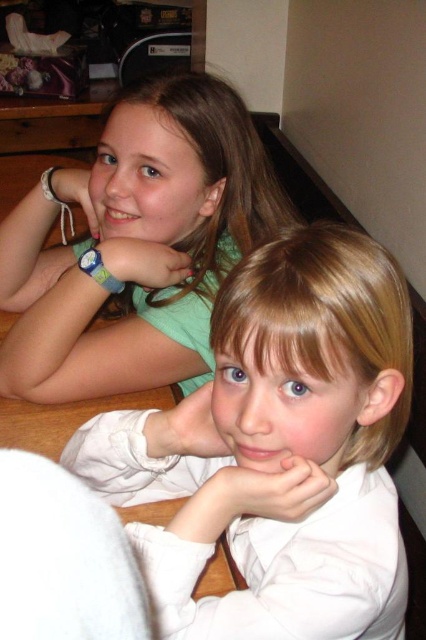
You are standing in front of the image and want to touch the white smooth shirt at center. If your hand can reach up to 16 inches, will you be able to touch it?

The white smooth shirt at center is 17.08 inches from the camera. Since your hand can only reach up to 16 inches, you cannot touch it.

You are a photographer trying to capture a clear shot of both the white smooth shirt at center and the green matte shirt at upper left. Based on their positions, which one is closer to the camera?

The white smooth shirt at center is closer to the camera because it is in front of the green matte shirt at upper left.

You are a photographer setting up for a family portrait. You see the white smooth shirt at center and the green matte shirt at upper left in the frame. Which shirt should you adjust to ensure both are centered equally between them?

The white smooth shirt at center is positioned on the right side of green matte shirt at upper left, so you should move the green matte shirt at upper left to the right or the white smooth shirt at center to the left to center them equally.